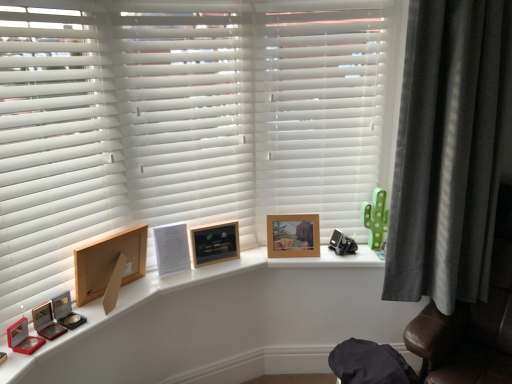
Question: Looking at their shapes, would you say dark grey velvet curtain at right is wider or thinner than white matte shutter at upper center, arranged as the third shutter when viewed from the left?

Choices:
 (A) wide
 (B) thin

Answer: (A)

Question: Is dark grey velvet curtain at right spatially inside white matte shutter at upper center, arranged as the third shutter when viewed from the left, or outside of it?

Choices:
 (A) outside
 (B) inside

Answer: (A)

Question: Estimate the real-world distances between objects in this image. Which object is closer to the brown leather swivel chair at right?

Choices:
 (A) wooden photo frame at center, which is the first picture frame in back-to-front order
 (B) wooden picture frame at left, which appears as the 1th picture frame when viewed from the left
 (C) white matte shutter at upper center, arranged as the third shutter when viewed from the left
 (D) green polka dot cactus at right
 (E) dark grey velvet curtain at right

Answer: (E)

Question: Which is farther from the white matte blinds at center, acting as the 2th shutter starting from the right?

Choices:
 (A) dark grey velvet curtain at right
 (B) wooden picture frame at left, which is the third picture frame from right to left
 (C) white matte shutter at upper center, arranged as the third shutter when viewed from the left
 (D) brown leather swivel chair at right
 (E) wooden photo frame at center, acting as the 3th picture frame starting from the left

Answer: (D)